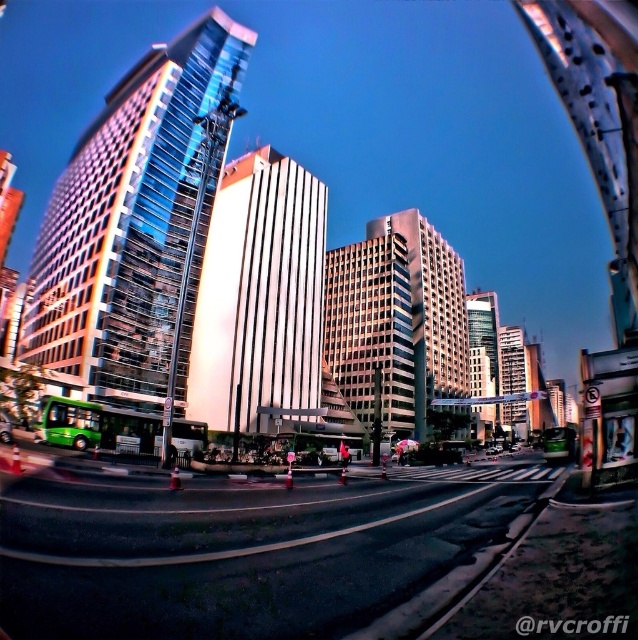
You are a photographer standing on the sidewalk and want to capture both the glassy reflective skyscraper at center and the white glass building at center in a single shot. Which building should you position yourself closer to in order to include both in the frame?

To include both the glassy reflective skyscraper at center and the white glass building at center in a single shot, you should position yourself closer to the white glass building at center since the glassy reflective skyscraper at center is on its left side, allowing for a wider angle to capture both.

You are standing on the sidewalk and see both the glassy reflective skyscraper at center and the white glass building at center. Which one is closer to you?

The glassy reflective skyscraper at center is closer to you because it is in front of the white glass building at center.